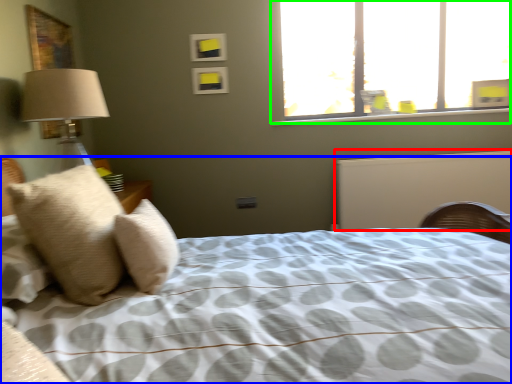
Question: Which object is positioned closest to radiator (highlighted by a red box)? Select from bed (highlighted by a blue box) and window (highlighted by a green box).

Choices:
 (A) bed
 (B) window

Answer: (B)